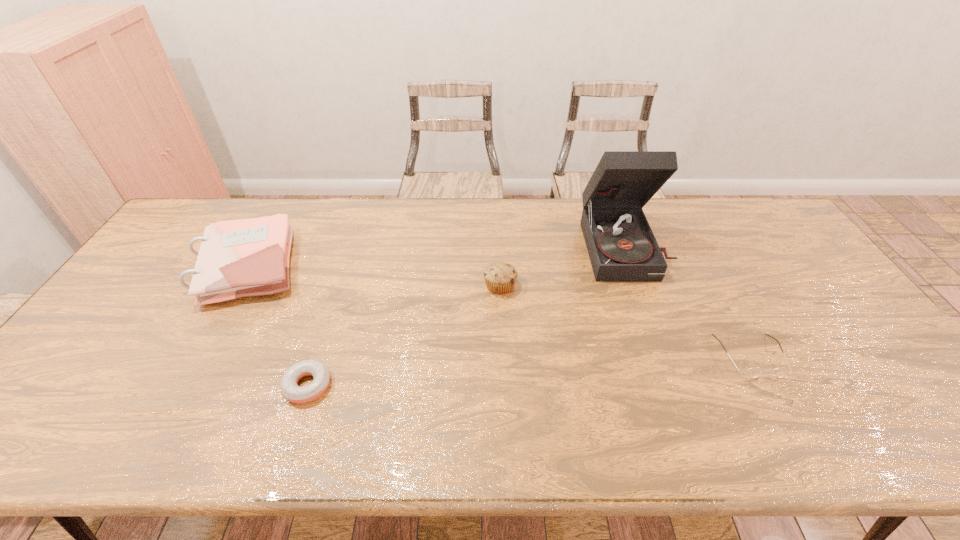
I want to click on free space between the rightmost object and the tallest object, so click(687, 301).

Locate an element on the screen. The width and height of the screenshot is (960, 540). free spot between the leftmost object and the phonograph_record is located at coordinates (436, 256).

Locate an element on the screen. This screenshot has height=540, width=960. free spot between the rightmost object and the fourth object from left to right is located at coordinates (687, 301).

The width and height of the screenshot is (960, 540). What are the coordinates of `vacant area between the fourth object from left to right and the muffin` in the screenshot? It's located at (563, 266).

Image resolution: width=960 pixels, height=540 pixels. What are the coordinates of `unoccupied position between the second object from right to left and the second object from left to right` in the screenshot? It's located at (467, 316).

Locate an element on the screen. This screenshot has height=540, width=960. free spot between the spectacles and the third object from left to right is located at coordinates (x=625, y=321).

Where is `empty space that is in between the phonograph_record and the rightmost object`? empty space that is in between the phonograph_record and the rightmost object is located at coordinates (687, 301).

Locate an element on the screen. The height and width of the screenshot is (540, 960). free spot between the phonograph_record and the leftmost object is located at coordinates (436, 256).

Locate an element on the screen. vacant region between the leftmost object and the muffin is located at coordinates (373, 275).

In order to click on empty space that is in between the muffin and the spectacles in this screenshot , I will do `click(625, 321)`.